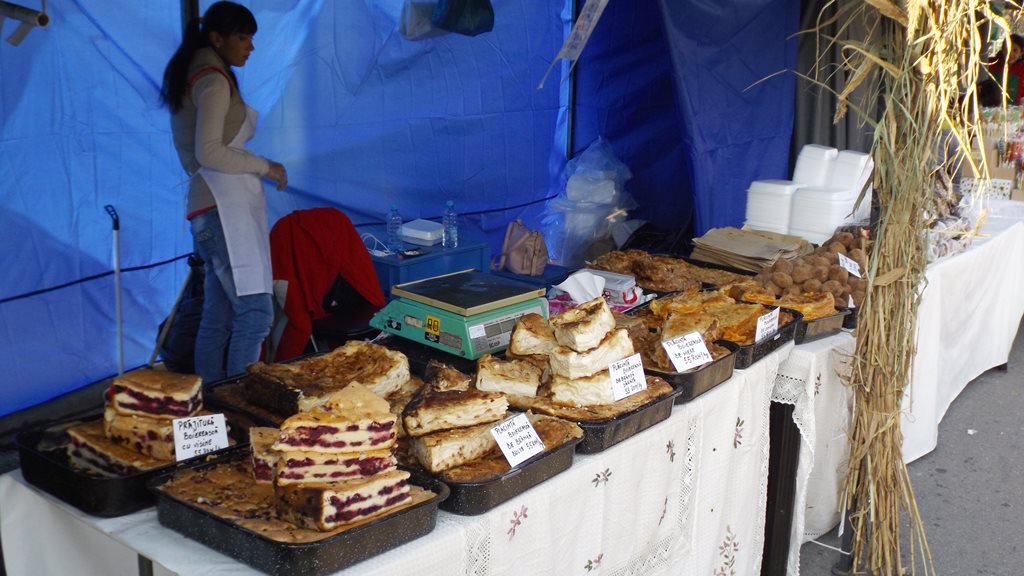
This screenshot has width=1024, height=576. In order to click on tablecloth in this screenshot , I will do `click(665, 469)`, `click(939, 338)`.